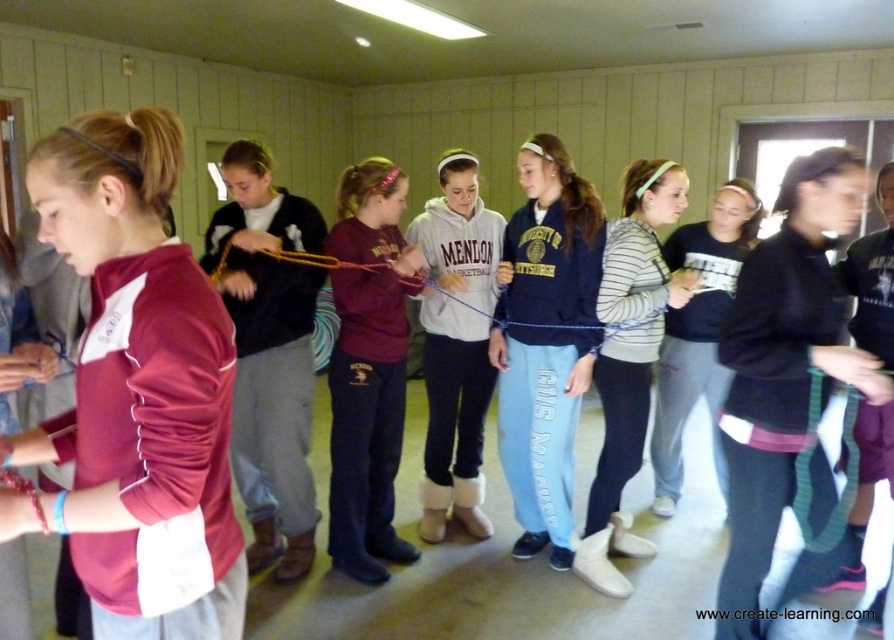
Does maroon fleece sweater at center have a lesser height compared to maroon fleece sweatshirt at center?

No, maroon fleece sweater at center is not shorter than maroon fleece sweatshirt at center.

Between point (296, 461) and point (339, 355), which one is positioned behind?

The point (296, 461) is behind.

Image resolution: width=894 pixels, height=640 pixels. I want to click on maroon fleece sweater at center, so click(x=268, y=353).

Is navy blue sweatshirt at center smaller than striped sweater at center?

Indeed, navy blue sweatshirt at center has a smaller size compared to striped sweater at center.

Does navy blue sweatshirt at center have a lesser width compared to striped sweater at center?

Yes.

Locate an element on the screen. The width and height of the screenshot is (894, 640). navy blue sweatshirt at center is located at coordinates (545, 340).

Where is `navy blue sweatshirt at center`? navy blue sweatshirt at center is located at coordinates pyautogui.click(x=545, y=340).

This screenshot has height=640, width=894. What do you see at coordinates (136, 392) in the screenshot? I see `maroon jersey at left` at bounding box center [136, 392].

Who is positioned more to the right, maroon jersey at left or dark gray sweatshirt at center?

dark gray sweatshirt at center

Is point (161, 284) closer to viewer compared to point (879, 236)?

Yes.

Locate an element on the screen. maroon jersey at left is located at coordinates (136, 392).